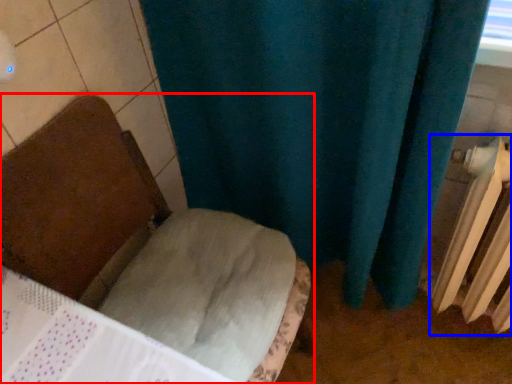
Question: Which of the following is the closest to the observer, furniture (highlighted by a red box) or radiator (highlighted by a blue box)?

Choices:
 (A) furniture
 (B) radiator

Answer: (A)